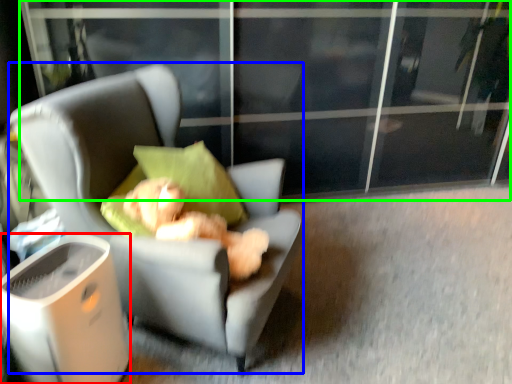
Question: Which is farther away from trash bin/can (highlighted by a red box)? chair (highlighted by a blue box) or screen door (highlighted by a green box)?

Choices:
 (A) chair
 (B) screen door

Answer: (B)